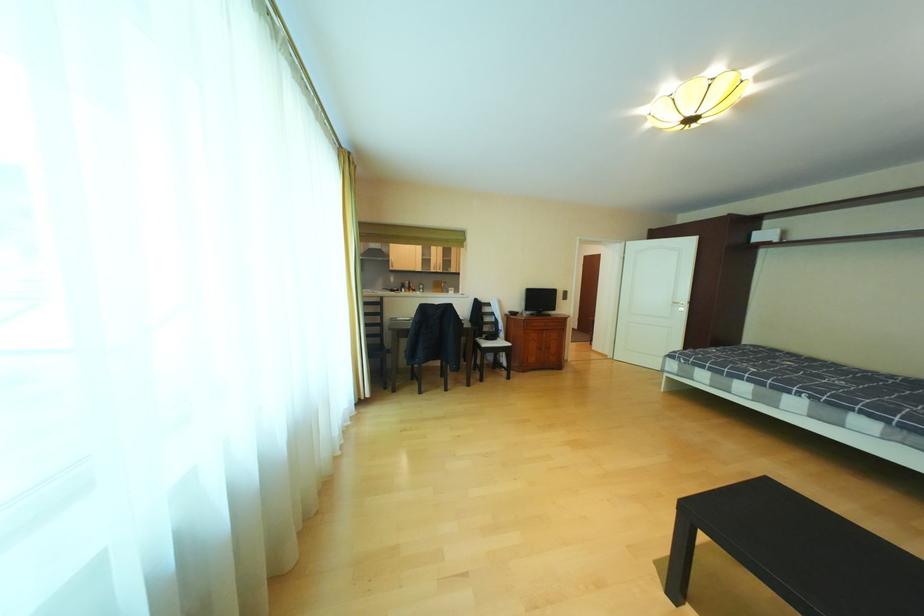
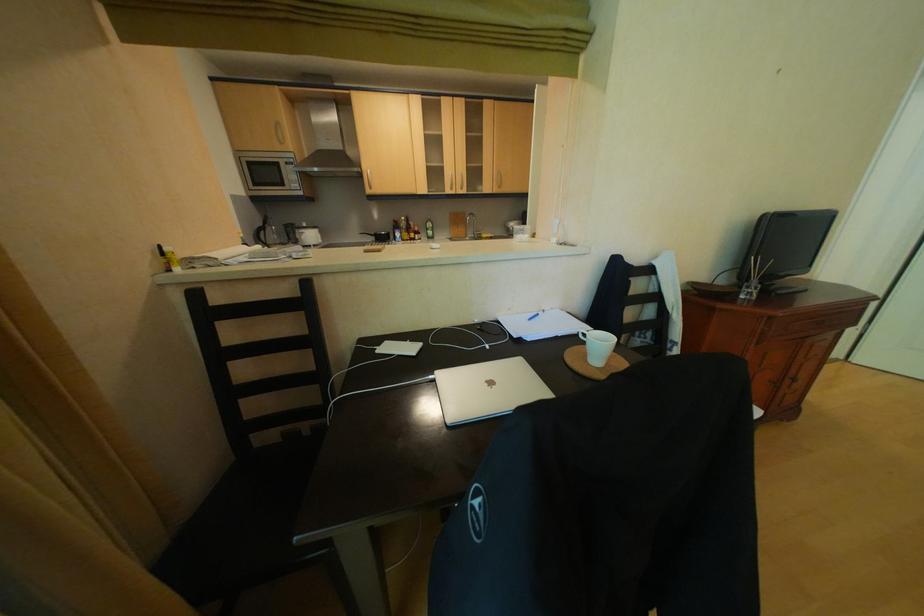
Where in the second image is the point corresponding to pixel 426 289 from the first image?

(429, 230)